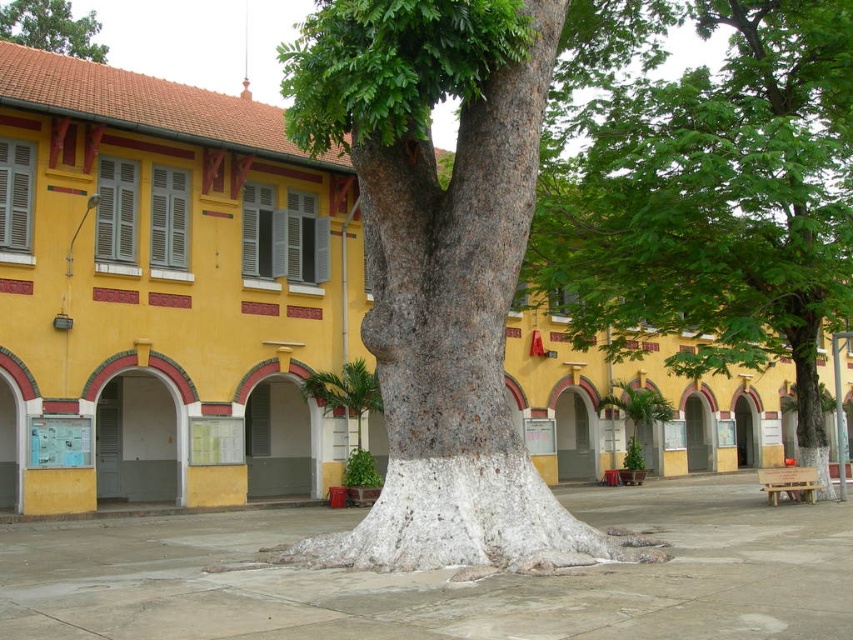
Is smooth bark tree at center in front of green leafy tree at center?

Yes, it is in front of green leafy tree at center.

Does smooth bark tree at center have a greater width compared to green leafy tree at center?

Yes, smooth bark tree at center is wider than green leafy tree at center.

At what (x,y) coordinates should I click in order to perform the action: click on smooth bark tree at center. Please return your answer as a coordinate pair (x, y). The image size is (853, 640). Looking at the image, I should click on (440, 268).

Can you confirm if smooth bark tree at center is smaller than green rough bark tree at upper center?

No.

Between smooth bark tree at center and green rough bark tree at upper center, which one has more height?

With more height is smooth bark tree at center.

Between point (486, 556) and point (28, 13), which one is positioned in front?

Point (486, 556) is more forward.

The width and height of the screenshot is (853, 640). In order to click on smooth bark tree at center in this screenshot , I will do `click(440, 268)`.

Locate an element on the screen. The width and height of the screenshot is (853, 640). green leafy tree at center is located at coordinates (705, 189).

Between green leafy tree at center and green rough bark tree at upper center, which one appears on the left side from the viewer's perspective?

green rough bark tree at upper center

Who is more distant from viewer, [641,288] or [33,20]?

The point [33,20] is more distant.

This screenshot has width=853, height=640. In order to click on green leafy tree at center in this screenshot , I will do `click(705, 189)`.